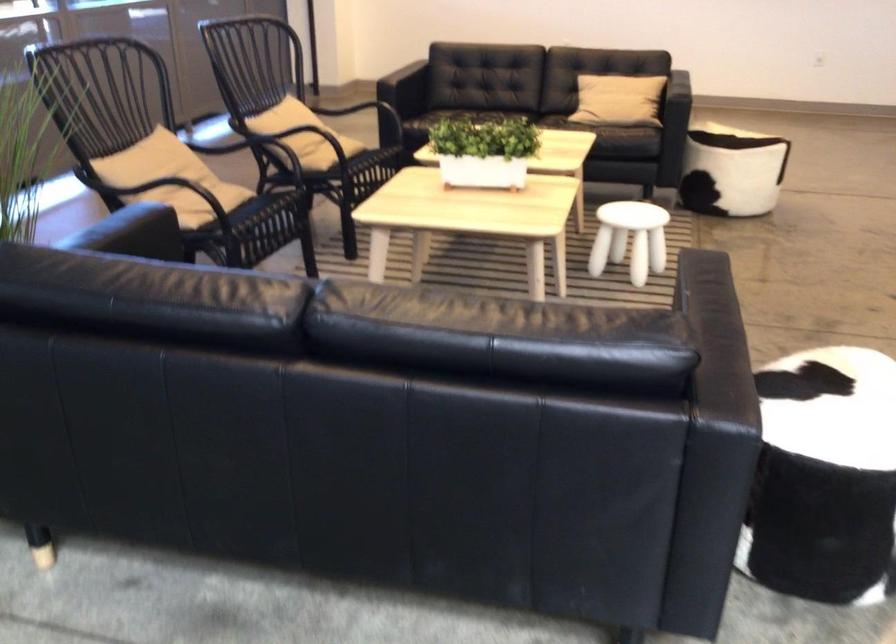
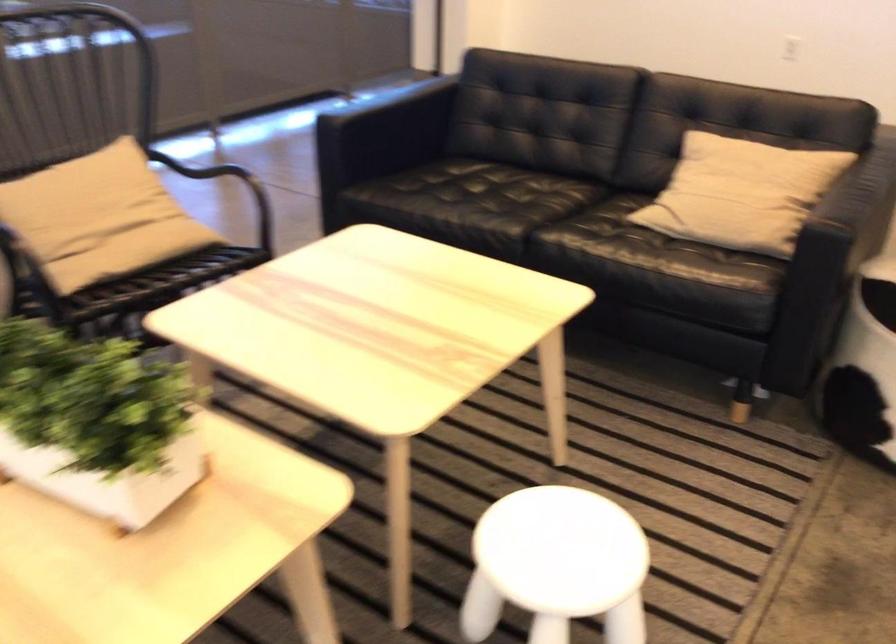
Where in the second image is the point corresponding to the point at 314,125 from the first image?

(99, 214)